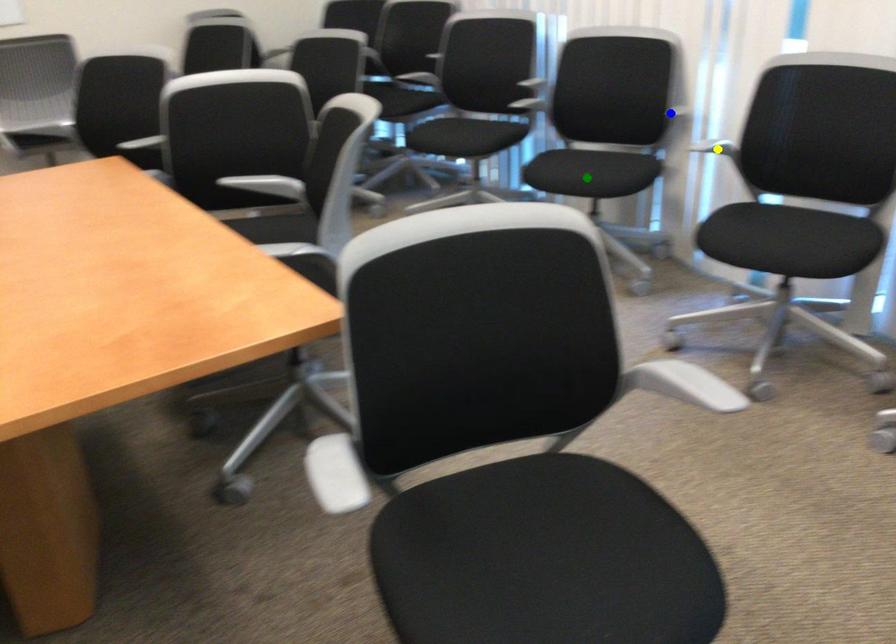
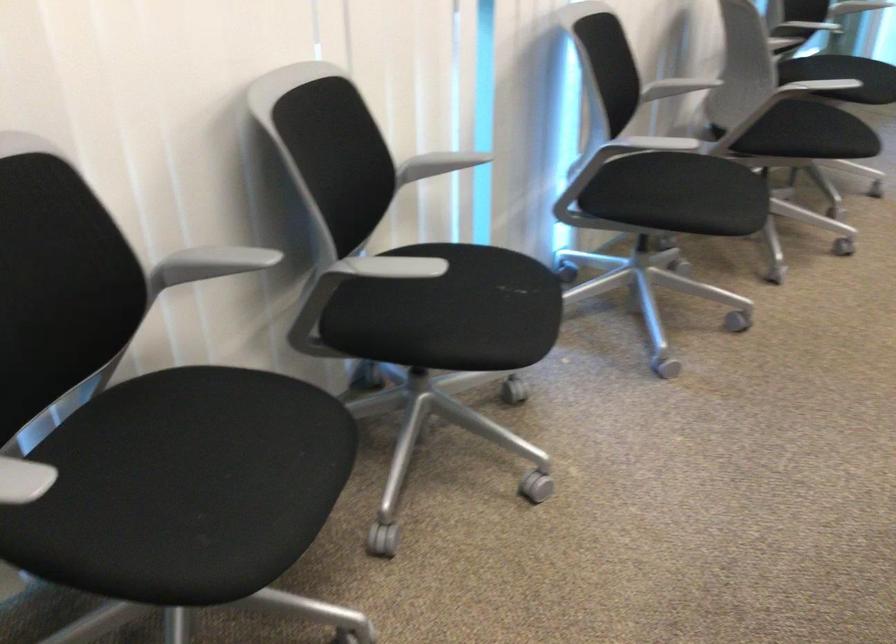
I am providing you with two images of the same scene from different viewpoints. Three points are marked in image1. Which point corresponds to a part or object that is occluded in image2?In image1, three points are marked. Which of them correspond to a part or object that is occluded in image2?Among the three points shown in image1, which one corresponds to a part or object that is no longer visible due to occlusion in image2?

Invisible in image2: yellow point.